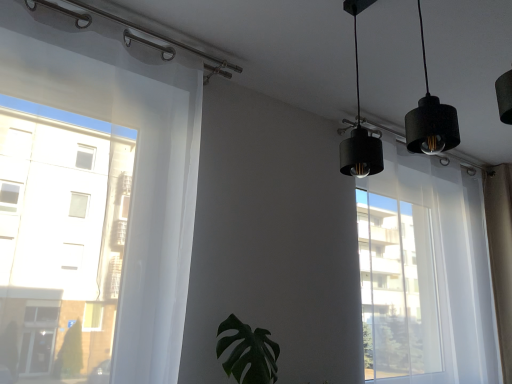
Question: Is black matte lampshade at upper right situated inside green matte leaf at center or outside?

Choices:
 (A) inside
 (B) outside

Answer: (B)

Question: From a real-world perspective, is black matte lampshade at upper right positioned above or below green matte leaf at center?

Choices:
 (A) below
 (B) above

Answer: (B)

Question: Is black matte lampshade at upper right to the left or to the right of green matte leaf at center in the image?

Choices:
 (A) left
 (B) right

Answer: (B)

Question: From the image's perspective, is green matte leaf at center positioned above or below black matte lampshade at upper right?

Choices:
 (A) above
 (B) below

Answer: (B)

Question: Considering the positions of point [x=258, y=362] and point [x=460, y=314], is point [x=258, y=362] closer or farther from the camera than point [x=460, y=314]?

Choices:
 (A) farther
 (B) closer

Answer: (B)

Question: Is green matte leaf at center in front of or behind black matte lampshade at upper right in the image?

Choices:
 (A) front
 (B) behind

Answer: (A)

Question: Looking at the image, does green matte leaf at center seem bigger or smaller compared to black matte lampshade at upper right?

Choices:
 (A) big
 (B) small

Answer: (B)